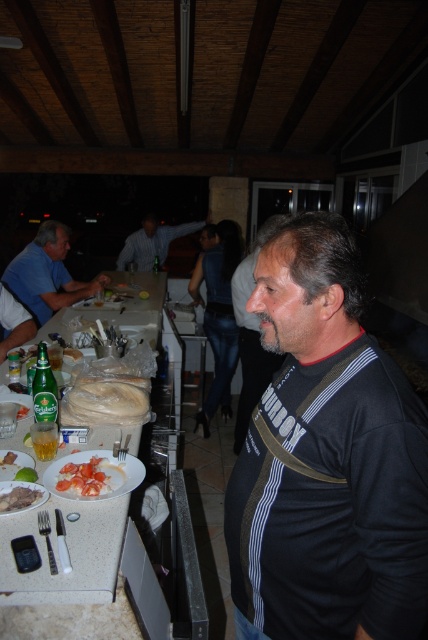
Question: Which object is positioned farthest from the matte blue shirt at left?

Choices:
 (A) white speckled table at left
 (B) tomato slices at center

Answer: (B)

Question: From the image, what is the correct spatial relationship of blue shirt at center in relation to white plastic plate at center?

Choices:
 (A) above
 (B) below

Answer: (A)

Question: Which point is closer to the camera taking this photo?

Choices:
 (A) (15, 497)
 (B) (139, 292)

Answer: (A)

Question: Among these objects, which one is farthest from the camera?

Choices:
 (A) blue shirt at center
 (B) white speckled table at left

Answer: (A)

Question: Is white bread at left thinner than meat at center?

Choices:
 (A) yes
 (B) no

Answer: (B)

Question: Does matte blue shirt at left have a lesser width compared to white plastic plate at center?

Choices:
 (A) no
 (B) yes

Answer: (A)